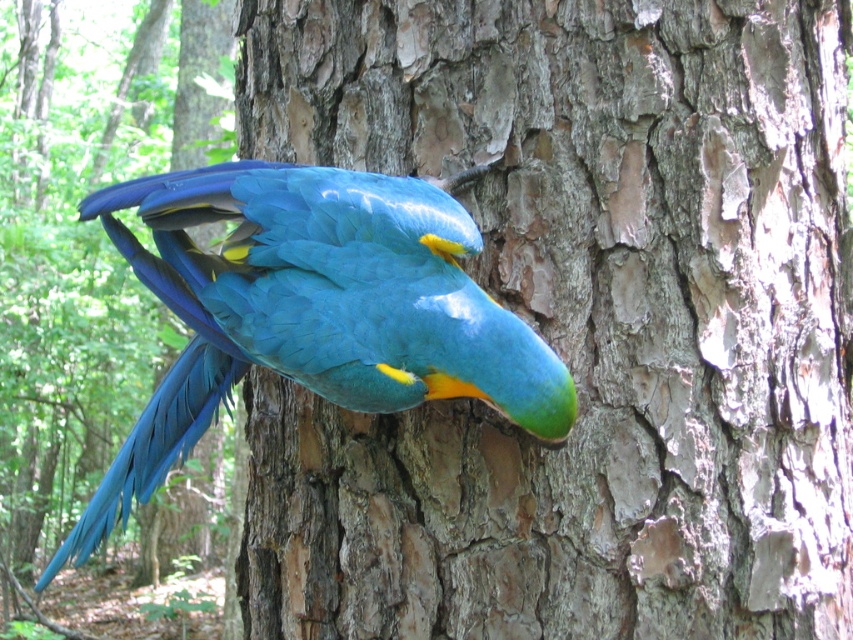
Looking at this image, you are standing in the forest and see the rough bark tree trunk at center. Can you estimate its position in terms of coordinates?

The rough bark tree trunk at center is located at coordinates approximately 0.505 in the x axis and 0.678 in the y axis.

You are a birdwatcher observing the rough bark tree trunk at center and the blue glossy parrot at center. Which object is located more to the left?

The blue glossy parrot at center is more to the left because the rough bark tree trunk at center is positioned on the right side of it.